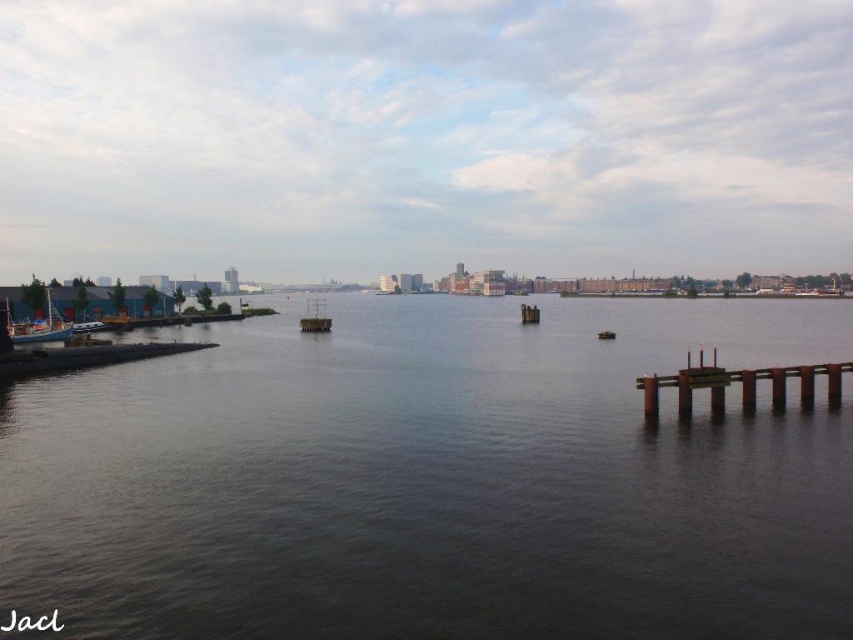
Between dark water at center and metallic grid at center, which one has more height?

Standing taller between the two is metallic grid at center.

Can you confirm if dark water at center is wider than metallic grid at center?

Yes, dark water at center is wider than metallic grid at center.

Is point (477, 506) less distant than point (312, 317)?

Yes, it is.

The width and height of the screenshot is (853, 640). In order to click on dark water at center in this screenshot , I will do `click(434, 480)`.

Between dark water at center and brown wooden dock at right, which one has more height?

With more height is dark water at center.

The width and height of the screenshot is (853, 640). What do you see at coordinates (434, 480) in the screenshot?
I see `dark water at center` at bounding box center [434, 480].

Find the location of a particular element. dark water at center is located at coordinates (434, 480).

Find the location of a particular element. dark water at center is located at coordinates (434, 480).

Is dark water at center bigger than wooden boat at left?

Correct, dark water at center is larger in size than wooden boat at left.

Is dark water at center below wooden boat at left?

Yes.

Does point (373, 560) lie behind point (41, 330)?

No, (373, 560) is in front of (41, 330).

Where is `dark water at center`? dark water at center is located at coordinates (434, 480).